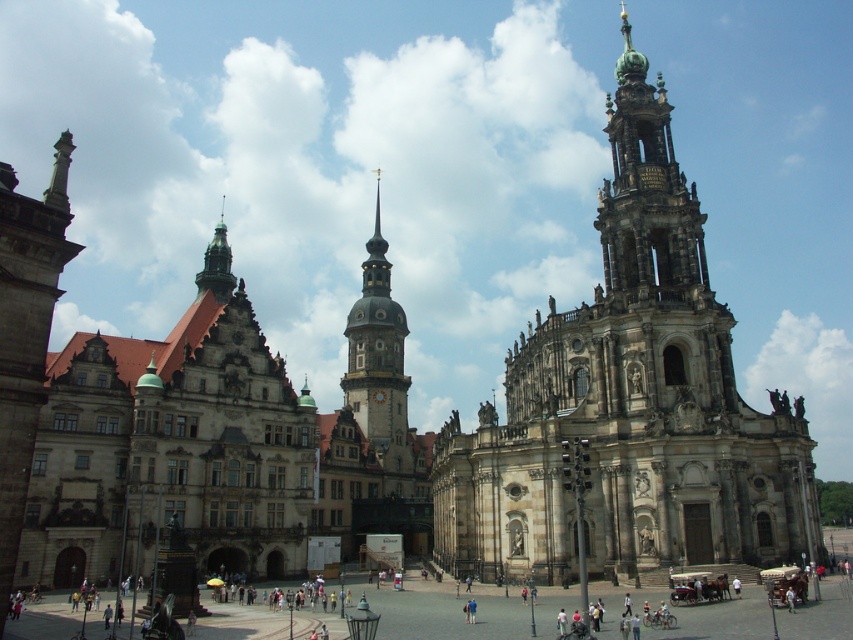
You are a tourist standing at the entrance of the cathedral on the right. You want to reach the stone spire at center without crossing the stone paved square at center. Is there enough space between them to walk around?

The stone paved square at center is 44.95 meters away from the stone spire at center. Since the square is between them, you can walk around it to reach the spire without crossing the square.

You are a tourist standing in front of the two buildings. You want to take a photo that includes both the stone paved square at center and the stone column at left. Which object should you position closer to the center of your camera frame to ensure both are fully visible?

You should position the stone paved square at center closer to the center of your camera frame because it might be wider than the stone column at left, allowing both to fit within the frame more easily.